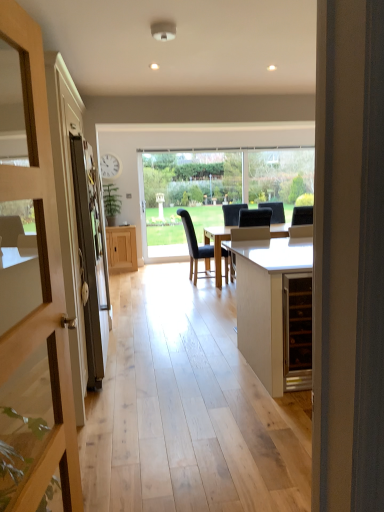
Where is `matte black screen door at left`? This screenshot has width=384, height=512. matte black screen door at left is located at coordinates (80, 232).

The height and width of the screenshot is (512, 384). What do you see at coordinates (188, 195) in the screenshot? I see `transparent glass window at center` at bounding box center [188, 195].

You are a GUI agent. You are given a task and a screenshot of the screen. Output one action in this format:
    pyautogui.click(x=<x>, y=<y>)
    Task: Click on the wooden cabinet at center, the 2th cabinetry positioned from the front
    
    Given the screenshot: What is the action you would take?
    pyautogui.click(x=121, y=249)

In order to face black fabric chair at center, should I rotate leftwards or rightwards?

You should look right and rotate roughly 1.312 degrees.

Locate an element on the screen. matte black screen door at left is located at coordinates (80, 232).

Looking at this image, is black leather swivel chair at center positioned with its back to black fabric chair at center?

black leather swivel chair at center does not have its back to black fabric chair at center.

Which of these two, black leather swivel chair at center or black fabric chair at center, stands taller?

black fabric chair at center is taller.

Is black leather swivel chair at center beside black fabric chair at center?

black leather swivel chair at center and black fabric chair at center are clearly separated.

From the picture: From a real-world perspective, is transparent glass window at center physically below black leather swivel chair at center?

No, from a real-world perspective, transparent glass window at center is not under black leather swivel chair at center.

Considering the sizes of objects transparent glass window at center and black leather swivel chair at center in the image provided, who is taller, transparent glass window at center or black leather swivel chair at center?

With more height is transparent glass window at center.

Can you confirm if white wood wine cabinet at center, positioned as the 1th cabinetry in right-to-left order, is wider than matte black screen door at left?

Yes, white wood wine cabinet at center, positioned as the 1th cabinetry in right-to-left order, is wider than matte black screen door at left.

Considering the positions of point (244, 298) and point (80, 228), is point (244, 298) closer or farther from the camera than point (80, 228)?

Point (244, 298) is positioned farther from the camera compared to point (80, 228).

Which object is closer to the camera, white wood wine cabinet at center, positioned as the 1th cabinetry in right-to-left order, or matte black screen door at left?

→ white wood wine cabinet at center, positioned as the 1th cabinetry in right-to-left order.

Is black leather swivel chair at center facing away from matte black screen door at left?

No, black leather swivel chair at center is not facing the opposite direction of matte black screen door at left.

Which is closer, (259, 225) or (90, 210)?

The point (90, 210) is in front.

Can you confirm if black leather swivel chair at center is bigger than matte black screen door at left?

No, black leather swivel chair at center is not bigger than matte black screen door at left.

Does black leather swivel chair at center have a greater height compared to matte black screen door at left?

No.

Is wooden door at left at the right side of transparent glass window at center?

No, wooden door at left is not to the right of transparent glass window at center.

Which is nearer, (73, 412) or (203, 175)?

Point (73, 412) appears to be closer to the viewer than point (203, 175).

Is wooden door at left shorter than transparent glass window at center?

Correct, wooden door at left is not as tall as transparent glass window at center.

Choose the correct answer: Is wooden door at left inside transparent glass window at center or outside it?

wooden door at left is not inside transparent glass window at center, it's outside.

Considering the relative sizes of wooden door at left and black leather swivel chair at center in the image provided, is wooden door at left wider than black leather swivel chair at center?

In fact, wooden door at left might be narrower than black leather swivel chair at center.

From a real-world perspective, which is physically above, wooden door at left or black leather swivel chair at center?

From a 3D spatial view, wooden door at left is above.

Considering the positions of point (28, 83) and point (230, 276), is point (28, 83) closer or farther from the camera than point (230, 276)?

Point (28, 83).

Is matte black screen door at left looking in the opposite direction of transparent glass window at center?

No, transparent glass window at center is not at the back of matte black screen door at left.

Can you confirm if matte black screen door at left is shorter than transparent glass window at center?

Yes, matte black screen door at left is shorter than transparent glass window at center.

Is matte black screen door at left bigger than transparent glass window at center?

Yes, matte black screen door at left is bigger than transparent glass window at center.

How much distance is there between matte black screen door at left and transparent glass window at center?

matte black screen door at left is 3.22 meters from transparent glass window at center.

Image resolution: width=384 pixels, height=512 pixels. I want to click on chair lying behind the black leather swivel chair at center, so click(x=194, y=245).

Locate an element on the screen. window located above the black leather swivel chair at center (from a real-world perspective) is located at coordinates (188, 195).

Considering their positions, is white wood wine cabinet at center, which is the 1th cabinetry from front to back, positioned closer to wooden door at left than black fabric chair at center?

white wood wine cabinet at center, which is the 1th cabinetry from front to back, is closer to wooden door at left.

Considering their positions, is transparent glass window at center positioned further to black leather swivel chair at center than wooden cabinet at center, the 2th cabinetry positioned from the front?

Based on the image, wooden cabinet at center, the 2th cabinetry positioned from the front, appears to be further to black leather swivel chair at center.

Estimate the real-world distances between objects in this image. Which object is closer to matte black screen door at left, transparent glass window at center or wooden door at left?

wooden door at left is closer to matte black screen door at left.

Consider the image. Estimate the real-world distances between objects in this image. Which object is further from transparent glass window at center, matte black screen door at left or wooden door at left?

wooden door at left.

Considering their positions, is transparent glass window at center positioned further to black leather swivel chair at center than matte black screen door at left?

Based on the image, matte black screen door at left appears to be further to black leather swivel chair at center.

Estimate the real-world distances between objects in this image. Which object is closer to black leather swivel chair at center, transparent glass window at center or black fabric chair at center?

Based on the image, transparent glass window at center appears to be nearer to black leather swivel chair at center.

From the image, which object appears to be farther from white wood wine cabinet at center, positioned as the 1th cabinetry in right-to-left order, black leather swivel chair at center or wooden cabinet at center, which appears as the 1th cabinetry when viewed from the left?

wooden cabinet at center, which appears as the 1th cabinetry when viewed from the left, is further to white wood wine cabinet at center, positioned as the 1th cabinetry in right-to-left order.

Which object lies nearer to the anchor point white wood wine cabinet at center, which is the 1th cabinetry from front to back, transparent glass window at center or black fabric chair at center?

Based on the image, transparent glass window at center appears to be nearer to white wood wine cabinet at center, which is the 1th cabinetry from front to back.

This screenshot has width=384, height=512. Identify the location of screen door located between white wood wine cabinet at center, positioned as the 1th cabinetry in right-to-left order, and black leather swivel chair at center in the depth direction. (80, 232).

Where is `cabinetry between wooden door at left and black fabric chair at center from front to back`? cabinetry between wooden door at left and black fabric chair at center from front to back is located at coordinates (267, 303).

Locate an element on the screen. The image size is (384, 512). cabinetry between black fabric chair at center and transparent glass window at center in the front-back direction is located at coordinates (121, 249).

The height and width of the screenshot is (512, 384). What are the coordinates of `screen door between white wood wine cabinet at center, which is the 1th cabinetry from front to back, and black fabric chair at center from front to back` in the screenshot? It's located at (80, 232).